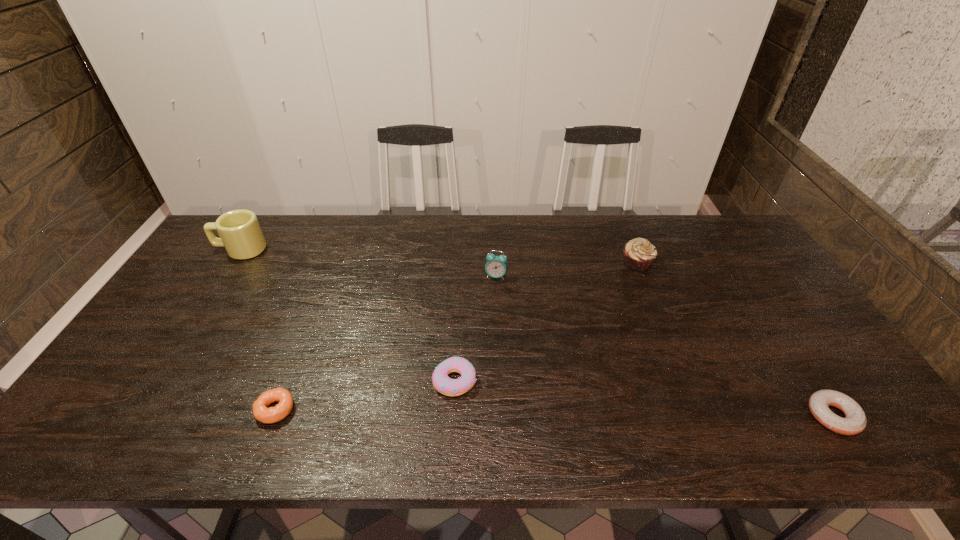
Locate an element on the screen. The height and width of the screenshot is (540, 960). vacant area that satisfies the following two spatial constraints: 1. with the handle on the side of the second doughnut from right to left; 2. on the left side of the mug is located at coordinates pyautogui.click(x=156, y=381).

You are a GUI agent. You are given a task and a screenshot of the screen. Output one action in this format:
    pyautogui.click(x=<x>, y=<y>)
    Task: Click on the blank space that satisfies the following two spatial constraints: 1. with the handle on the side of the tallest object; 2. on the left side of the fourth object from right to left
    The height and width of the screenshot is (540, 960).
    Given the screenshot: What is the action you would take?
    pyautogui.click(x=156, y=381)